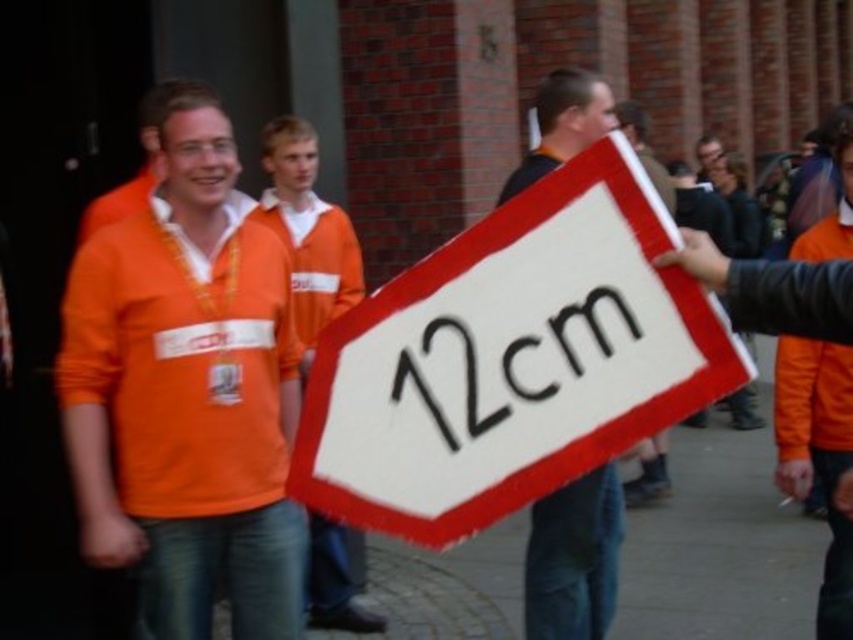
Between orange jersey at center and white fabric sign at center, which one has less height?

With less height is white fabric sign at center.

Which is in front, point (264, 280) or point (595, 497)?

Point (264, 280) is in front.

Find the location of `orange jersey at center`. orange jersey at center is located at coordinates (186, 394).

Which is above, white felt sign at center or orange jersey at center?

orange jersey at center is higher up.

Measure the distance between white felt sign at center and camera.

They are 6.70 feet apart.

Image resolution: width=853 pixels, height=640 pixels. What are the coordinates of `white felt sign at center` in the screenshot? It's located at (511, 358).

Who is more forward, (352, 371) or (548, 100)?

Positioned in front is point (352, 371).

Looking at this image, is white felt sign at center wider than white fabric sign at center?

Indeed, white felt sign at center has a greater width compared to white fabric sign at center.

This screenshot has height=640, width=853. Identify the location of white felt sign at center. (511, 358).